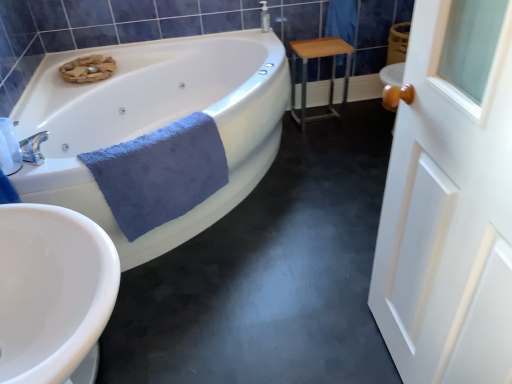
Question: From the image's perspective, would you say light brown wood table at center right is positioned over blue soft towel at lower left?

Choices:
 (A) no
 (B) yes

Answer: (B)

Question: Is light brown wood table at center right oriented towards blue soft towel at lower left?

Choices:
 (A) yes
 (B) no

Answer: (B)

Question: Can you confirm if light brown wood table at center right is taller than blue soft towel at lower left?

Choices:
 (A) no
 (B) yes

Answer: (B)

Question: Can you confirm if light brown wood table at center right is bigger than blue soft towel at lower left?

Choices:
 (A) no
 (B) yes

Answer: (A)

Question: Can you confirm if light brown wood table at center right is smaller than blue soft towel at lower left?

Choices:
 (A) no
 (B) yes

Answer: (B)

Question: Is light brown wood table at center right turned away from blue soft towel at lower left?

Choices:
 (A) yes
 (B) no

Answer: (B)

Question: Is blue soft towel at lower left far away from white wooden door at right?

Choices:
 (A) no
 (B) yes

Answer: (A)

Question: Is white wooden door at right located within blue soft towel at lower left?

Choices:
 (A) no
 (B) yes

Answer: (A)

Question: From a real-world perspective, is blue soft towel at lower left positioned under white wooden door at right based on gravity?

Choices:
 (A) no
 (B) yes

Answer: (B)

Question: Does blue soft towel at lower left lie behind white wooden door at right?

Choices:
 (A) yes
 (B) no

Answer: (A)

Question: From a real-world perspective, is blue soft towel at lower left over white wooden door at right?

Choices:
 (A) yes
 (B) no

Answer: (B)

Question: Is blue soft towel at lower left wider than white wooden door at right?

Choices:
 (A) yes
 (B) no

Answer: (A)

Question: Can you confirm if white glossy bathtub at upper left is smaller than white wooden door at right?

Choices:
 (A) no
 (B) yes

Answer: (A)